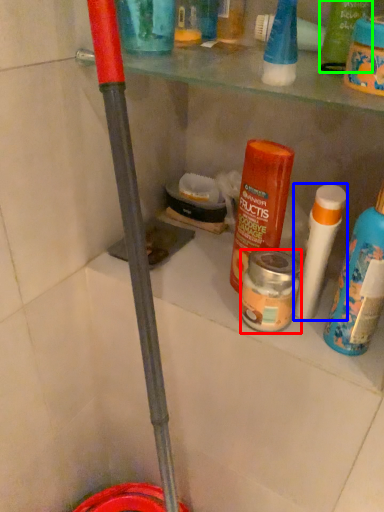
Question: Which is nearer to the product (highlighted by a red box)? cleaning product (highlighted by a blue box) or product (highlighted by a green box).

Choices:
 (A) cleaning product
 (B) product

Answer: (A)